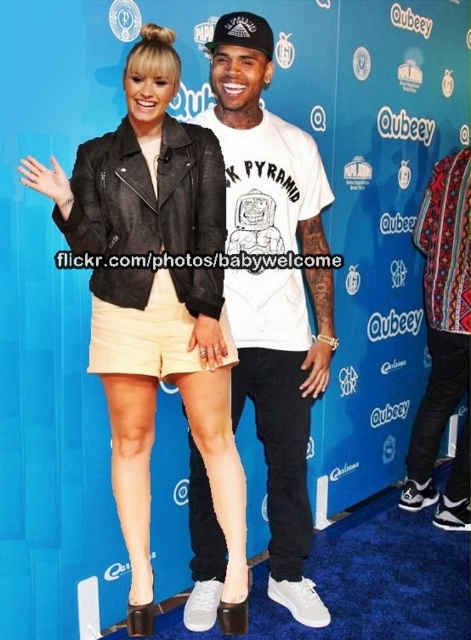
Question: Considering the real-world distances, which object is farthest from the black leather jacket at center?

Choices:
 (A) white cotton t-shirt at center
 (B) patterned fabric jacket at right

Answer: (B)

Question: Which object is farther from the camera taking this photo?

Choices:
 (A) black leather jacket at center
 (B) white cotton t-shirt at center
 (C) patterned fabric jacket at right

Answer: (C)

Question: Is black leather jacket at center above patterned fabric jacket at right?

Choices:
 (A) yes
 (B) no

Answer: (B)

Question: Is black leather jacket at center smaller than patterned fabric jacket at right?

Choices:
 (A) yes
 (B) no

Answer: (B)

Question: Can you confirm if black leather jacket at center is smaller than patterned fabric jacket at right?

Choices:
 (A) no
 (B) yes

Answer: (A)

Question: Which object is closer to the camera taking this photo?

Choices:
 (A) black leather jacket at center
 (B) patterned fabric jacket at right

Answer: (A)